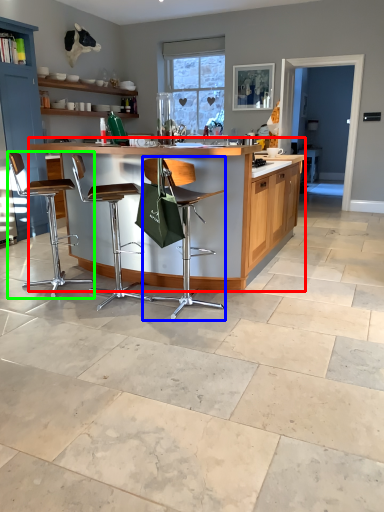
Question: Considering the real-world distances, which object is closest to table (highlighted by a red box)? chair (highlighted by a blue box) or chair (highlighted by a green box).

Choices:
 (A) chair
 (B) chair

Answer: (A)